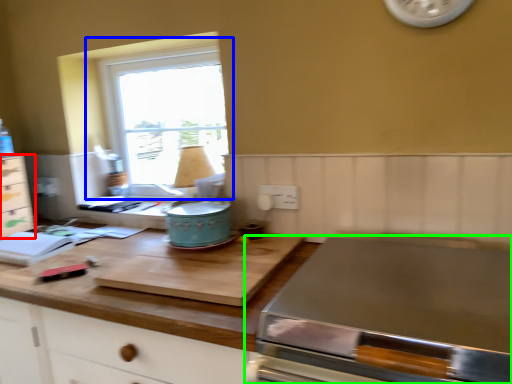
Question: Which is nearer to the cabinetry (highlighted by a red box)? window (highlighted by a blue box) or home appliance (highlighted by a green box).

Choices:
 (A) window
 (B) home appliance

Answer: (A)